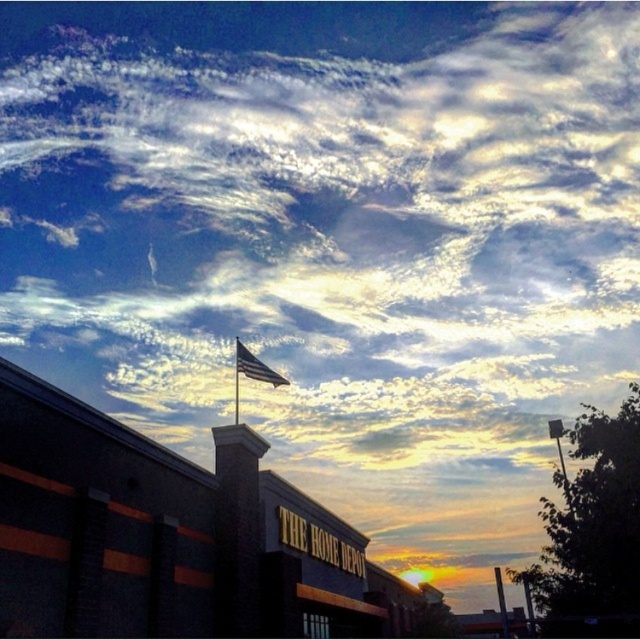
Question: Which point is closer to the camera?

Choices:
 (A) click(248, 374)
 (B) click(236, 337)
 (C) click(499, 577)

Answer: (A)

Question: Can you confirm if american flag at center is positioned to the left of metallic pole at right?

Choices:
 (A) yes
 (B) no

Answer: (A)

Question: Can you confirm if american flag at center is positioned to the right of metallic pole at right?

Choices:
 (A) no
 (B) yes

Answer: (A)

Question: Based on their relative distances, which object is farther from the metallic pole at right?

Choices:
 (A) metallic flag pole at upper center
 (B) american flag at center

Answer: (A)

Question: Does american flag at center appear under metallic pole at right?

Choices:
 (A) no
 (B) yes

Answer: (A)

Question: Estimate the real-world distances between objects in this image. Which object is farther from the american flag at center?

Choices:
 (A) metallic flag pole at upper center
 (B) metallic pole at right

Answer: (B)